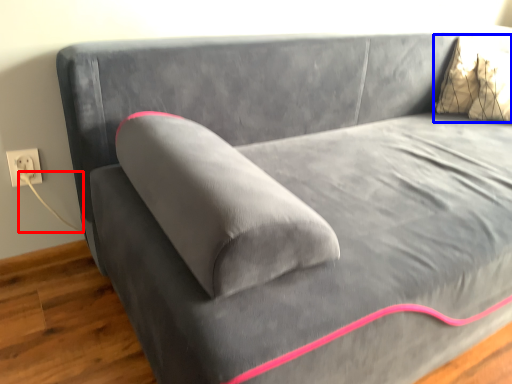
Question: Which object appears closest to the camera in this image, string (highlighted by a red box) or pillow (highlighted by a blue box)?

Choices:
 (A) string
 (B) pillow

Answer: (A)